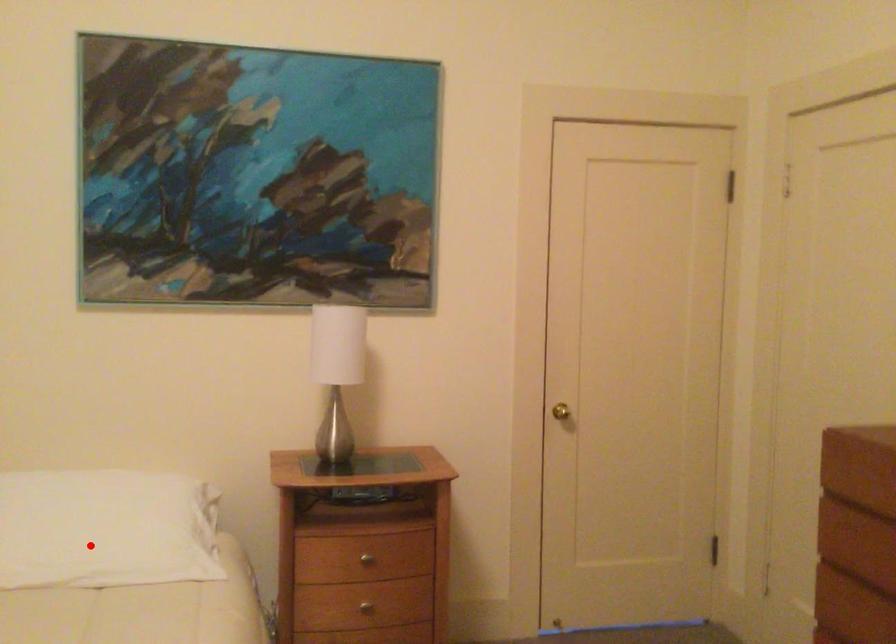
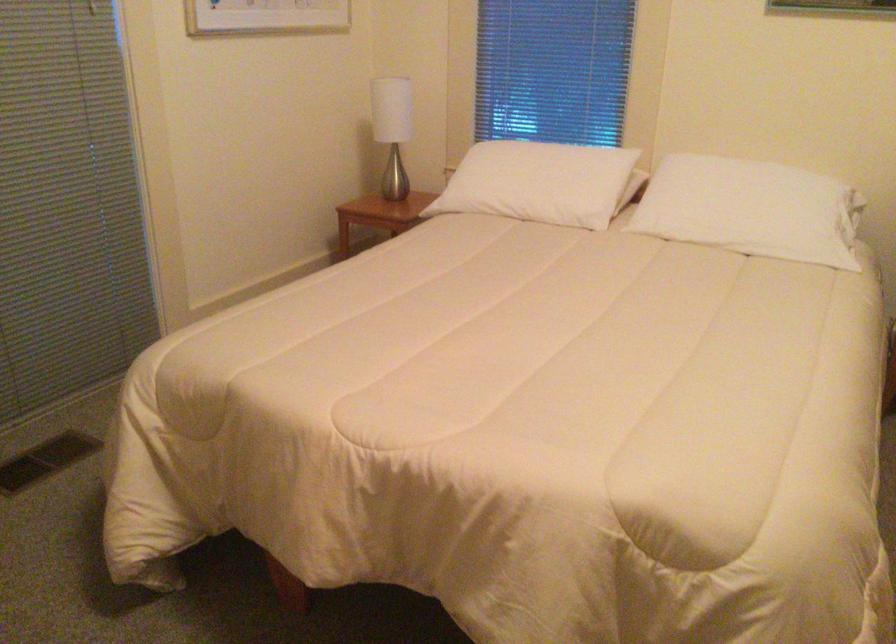
Question: I am providing you with two images of the same scene from different viewpoints. In image1, a red point is highlighted. Considering the same 3D point in image2, which of the following is correct?

Choices:
 (A) It is closer
 (B) It is farther

Answer: (B)